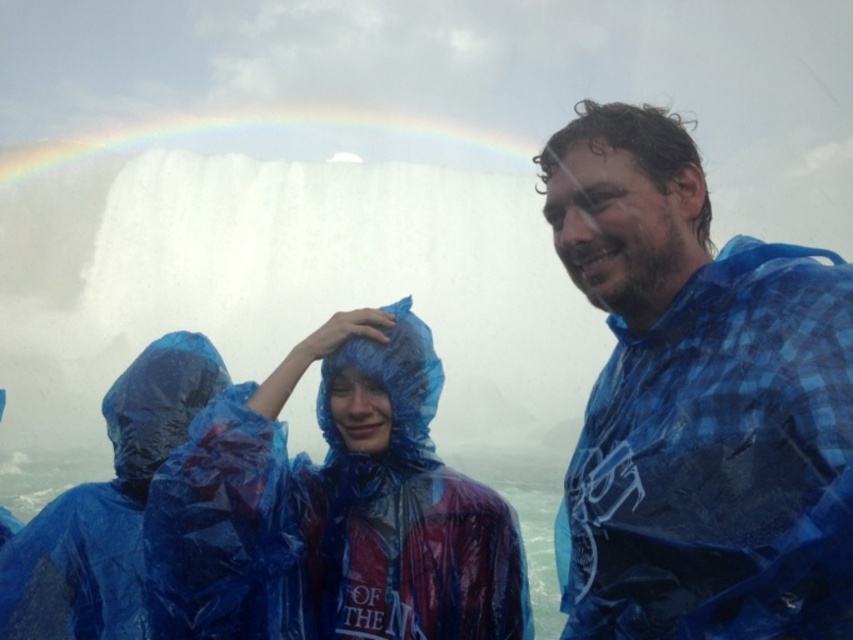
Which of these two, blue plaid shirt at center or transparent plastic raincoat at center, stands taller?

blue plaid shirt at center is taller.

Is point (741, 557) closer to camera compared to point (364, 481)?

Yes, it is.

Image resolution: width=853 pixels, height=640 pixels. What do you see at coordinates (698, 403) in the screenshot?
I see `blue plaid shirt at center` at bounding box center [698, 403].

Identify the location of blue plaid shirt at center. This screenshot has width=853, height=640. (698, 403).

Looking at this image, between blue plastic poncho at lower left and rainbow at upper center, which one has more height?

rainbow at upper center is taller.

Which is below, blue plastic poncho at lower left or rainbow at upper center?

blue plastic poncho at lower left

Measure the distance between blue plastic poncho at lower left and camera.

The distance of blue plastic poncho at lower left from camera is 30.64 meters.

Find the location of `blue plastic poncho at lower left`. blue plastic poncho at lower left is located at coordinates (107, 506).

Between blue plaid shirt at center and blue plastic poncho at lower left, which one has more height?

blue plaid shirt at center is taller.

Is blue plaid shirt at center wider than blue plastic poncho at lower left?

Indeed, blue plaid shirt at center has a greater width compared to blue plastic poncho at lower left.

Between point (720, 476) and point (85, 625), which one is positioned behind?

The point (85, 625) is behind.

You are a GUI agent. You are given a task and a screenshot of the screen. Output one action in this format:
    pyautogui.click(x=<x>, y=<y>)
    Task: Click on the blue plaid shirt at center
    
    Given the screenshot: What is the action you would take?
    pyautogui.click(x=698, y=403)